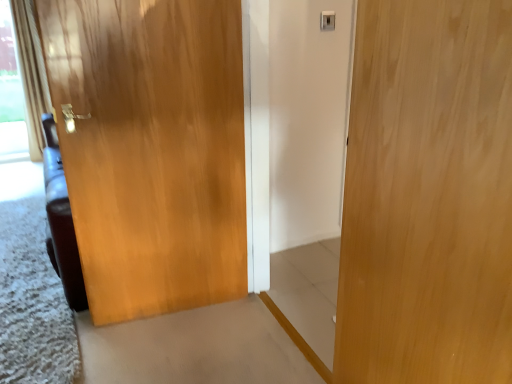
Question: Considering the positions of glossy wood door at left, the second door from the right, and beige textured curtain at left in the image, is glossy wood door at left, the second door from the right, taller or shorter than beige textured curtain at left?

Choices:
 (A) short
 (B) tall

Answer: (A)

Question: Considering the positions of glossy wood door at left, arranged as the 2th door when viewed from the front, and beige textured curtain at left in the image, is glossy wood door at left, arranged as the 2th door when viewed from the front, bigger or smaller than beige textured curtain at left?

Choices:
 (A) big
 (B) small

Answer: (B)

Question: Which is farther from the beige textured curtain at left?

Choices:
 (A) light wood door at center, placed as the 1th door when sorted from right to left
 (B) glossy wood door at left, arranged as the 2th door when viewed from the front

Answer: (A)

Question: Considering the real-world distances, which object is closest to the light wood door at center, placed as the 1th door when sorted from right to left?

Choices:
 (A) glossy wood door at left, arranged as the 2th door when viewed from the front
 (B) beige textured curtain at left

Answer: (A)